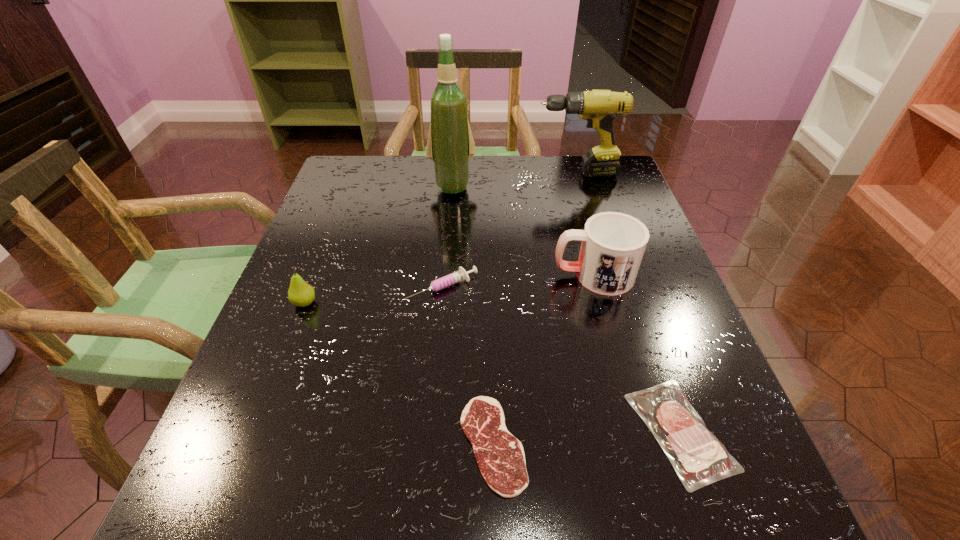
Where is `free location at the near edge`? This screenshot has width=960, height=540. free location at the near edge is located at coordinates (498, 522).

Locate an element on the screen. This screenshot has width=960, height=540. free space at the left edge of the desktop is located at coordinates (306, 442).

Locate an element on the screen. free spot at the right edge of the desktop is located at coordinates (645, 320).

Locate an element on the screen. This screenshot has height=540, width=960. free region at the far left corner of the desktop is located at coordinates (351, 167).

The image size is (960, 540). Identify the location of free space at the near left corner of the desktop. (218, 526).

I want to click on free region at the far right corner, so click(613, 185).

Locate an element on the screen. free area in between the mug and the tallest object is located at coordinates (523, 231).

You are a GUI agent. You are given a task and a screenshot of the screen. Output one action in this format:
    pyautogui.click(x=<x>, y=<y>)
    Task: Click on the vacant space that's between the mug and the sixth tallest object
    The image size is (960, 540).
    Given the screenshot: What is the action you would take?
    pyautogui.click(x=636, y=353)

Locate an element on the screen. This screenshot has height=540, width=960. free spot between the leftmost object and the fifth tallest object is located at coordinates (373, 295).

The height and width of the screenshot is (540, 960). Identify the location of blank region between the fifth shortest object and the pear. (449, 289).